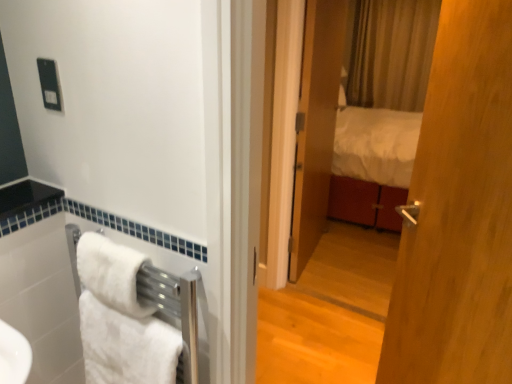
Locate an element on the screen. This screenshot has height=384, width=512. free location in front of wooden door at center is located at coordinates (332, 280).